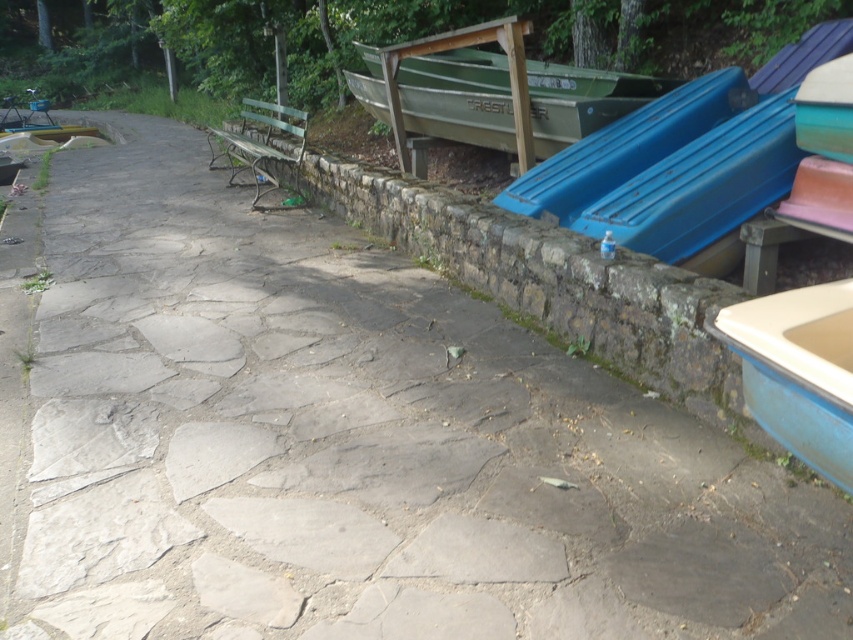
Does blue metallic boat at right have a larger size compared to green wooden bench at center?

No, blue metallic boat at right is not bigger than green wooden bench at center.

Who is more distant from viewer, (x=531, y=209) or (x=281, y=118)?

The point (x=281, y=118) is more distant.

Who is more distant from viewer, (799, 70) or (251, 125)?

Positioned behind is point (251, 125).

Identify the location of blue metallic boat at right. The height and width of the screenshot is (640, 853). (683, 161).

Looking at this image, which is below, blue metallic boat at right or green matte boat at upper center?

blue metallic boat at right is below.

Is blue metallic boat at right to the right of green matte boat at upper center from the viewer's perspective?

Correct, you'll find blue metallic boat at right to the right of green matte boat at upper center.

Is point (595, 216) positioned after point (561, 88)?

No, (595, 216) is closer to viewer.

Locate an element on the screen. The image size is (853, 640). blue metallic boat at right is located at coordinates (683, 161).

Between point (457, 58) and point (239, 147), which one is positioned in front?

Point (457, 58)

Is green matte boat at upper center positioned in front of green wooden bench at center?

That is True.

The image size is (853, 640). Describe the element at coordinates (456, 70) in the screenshot. I see `green matte boat at upper center` at that location.

Locate an element on the screen. The width and height of the screenshot is (853, 640). green matte boat at upper center is located at coordinates (456, 70).